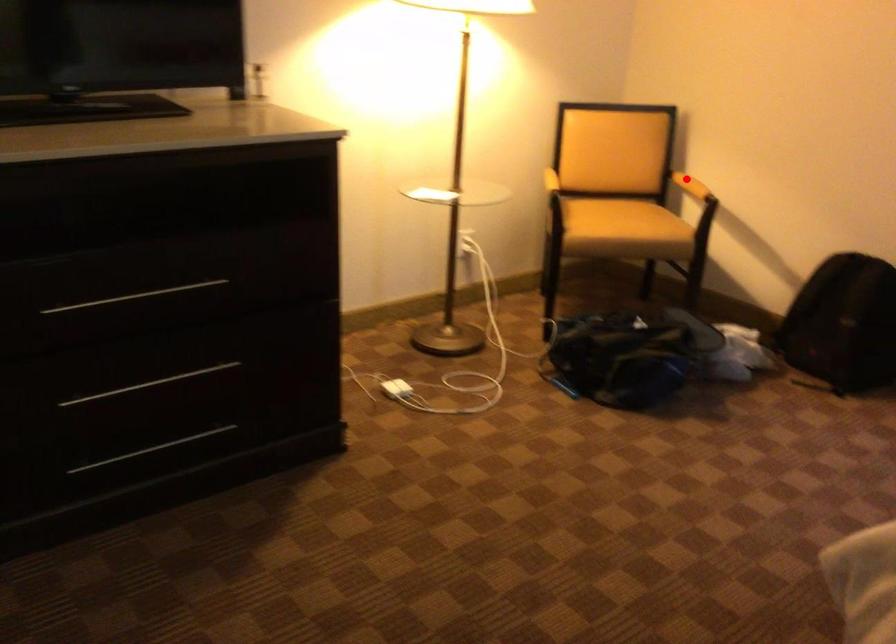
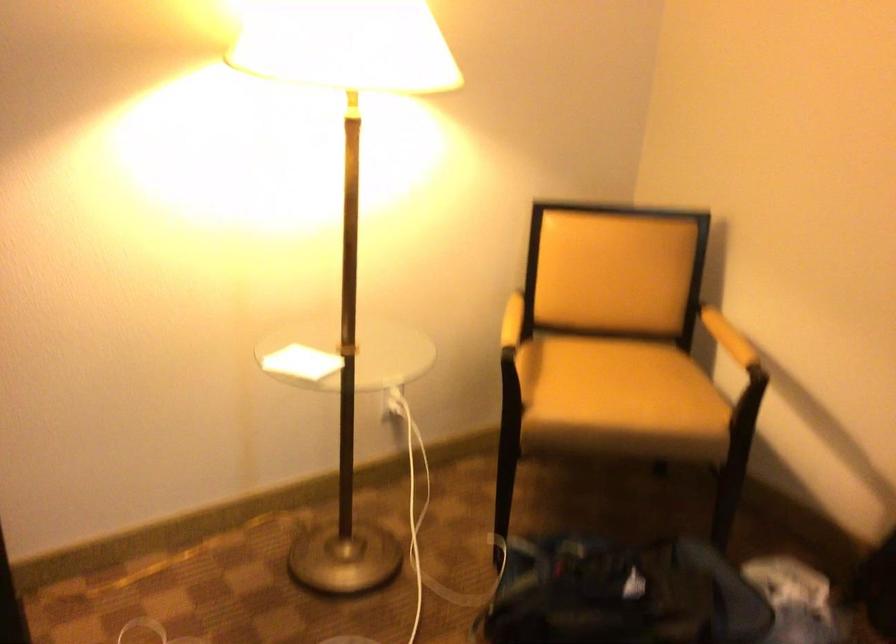
Question: I am providing you with two images of the same scene from different viewpoints. Image1 has a red point marked. In image2, the corresponding 3D location appears at what relative position? Reply with the corresponding letter.

Choices:
 (A) Closer
 (B) Farther

Answer: (A)